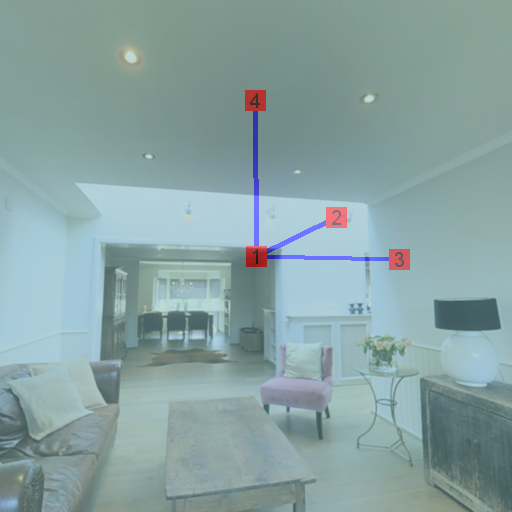
Locate an element on the screen. lamp is located at coordinates (469, 362).